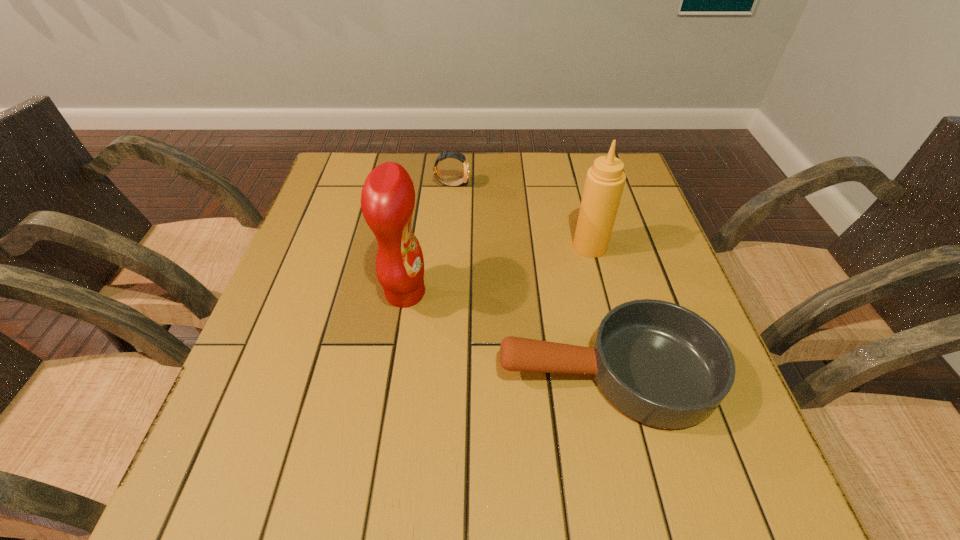
This screenshot has width=960, height=540. In order to click on vacant space at the far right corner of the desktop in this screenshot , I will do coord(638,199).

Identify the location of free space at the near right corner of the desktop. The image size is (960, 540). (723, 490).

This screenshot has width=960, height=540. In order to click on empty space between the right condiment and the shortest object in this screenshot , I will do `click(598, 309)`.

Where is `free space that is in between the right condiment and the second nearest object`? free space that is in between the right condiment and the second nearest object is located at coordinates (497, 270).

Identify the location of vacant area between the watch and the nearest object. Image resolution: width=960 pixels, height=540 pixels. (529, 278).

In order to click on empty space that is in between the farthest object and the second nearest object in this screenshot , I will do `click(428, 239)`.

You are a GUI agent. You are given a task and a screenshot of the screen. Output one action in this format:
    pyautogui.click(x=<x>, y=<y>)
    Task: Click on the vacant space that's between the shortest object and the farthest object
    This screenshot has height=540, width=960.
    Given the screenshot: What is the action you would take?
    pyautogui.click(x=529, y=278)

I want to click on empty location between the left condiment and the watch, so click(428, 239).

Find the location of `unoccupied position between the third farthest object and the nearest object`. unoccupied position between the third farthest object and the nearest object is located at coordinates (506, 333).

This screenshot has width=960, height=540. In order to click on vacant region between the shortest object and the right condiment in this screenshot , I will do `click(598, 309)`.